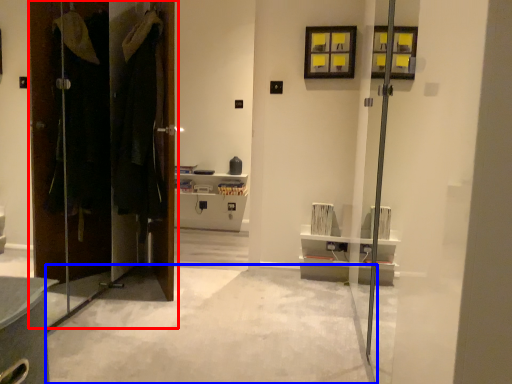
Question: Which of the following is the farthest to the observer, door (highlighted by a red box) or concrete (highlighted by a blue box)?

Choices:
 (A) door
 (B) concrete

Answer: (A)